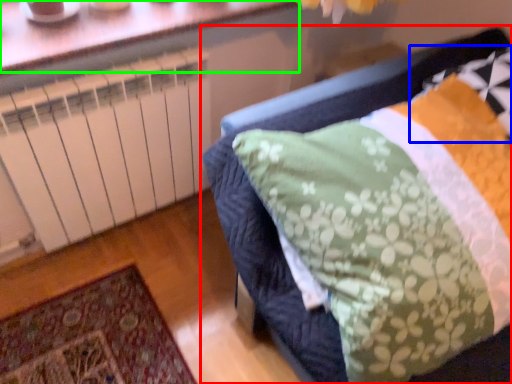
Question: Estimate the real-world distances between objects in this image. Which object is farther from furniture (highlighted by a red box), pillow (highlighted by a blue box) or window (highlighted by a green box)?

Choices:
 (A) pillow
 (B) window

Answer: (B)